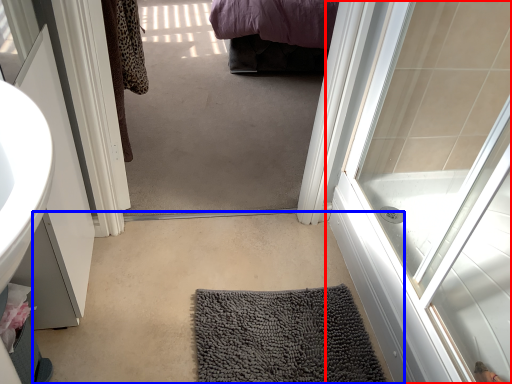
Question: Which of the following is the farthest to the observer, door (highlighted by a red box) or plain (highlighted by a blue box)?

Choices:
 (A) door
 (B) plain

Answer: (B)